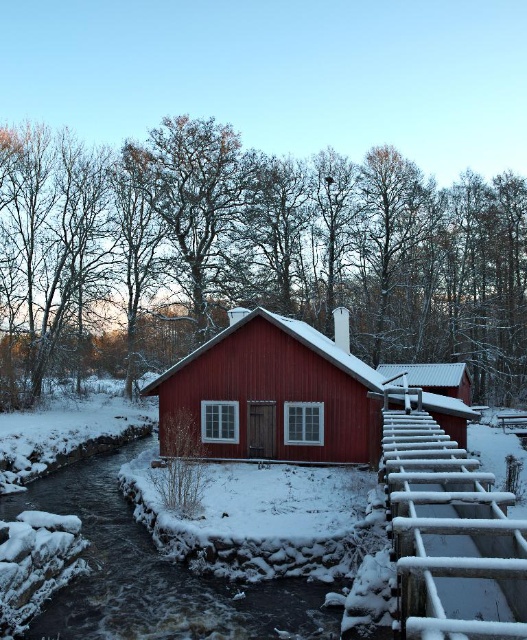
Question: Is matte wood cabin at center bigger than white wooden rail at lower right?

Choices:
 (A) no
 (B) yes

Answer: (B)

Question: Which point is farther from the camera taking this photo?

Choices:
 (A) (274, 365)
 (B) (458, 516)

Answer: (A)

Question: Which object appears farthest from the camera in this image?

Choices:
 (A) matte wood cabin at center
 (B) white wooden rail at lower right

Answer: (A)

Question: Is matte wood cabin at center to the left of white wooden rail at lower right from the viewer's perspective?

Choices:
 (A) yes
 (B) no

Answer: (A)

Question: Can you confirm if matte wood cabin at center is wider than white wooden rail at lower right?

Choices:
 (A) yes
 (B) no

Answer: (A)